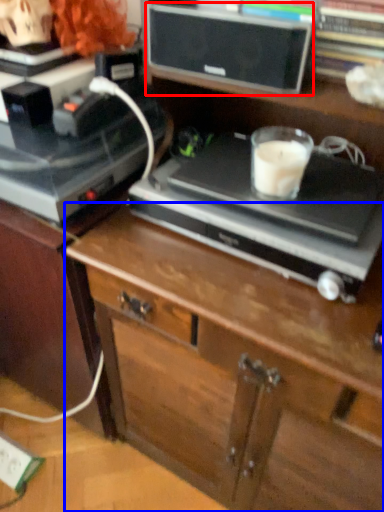
Question: Which object appears farthest to the camera in this image, speaker (highlighted by a red box) or chest of drawers (highlighted by a blue box)?

Choices:
 (A) speaker
 (B) chest of drawers

Answer: (A)